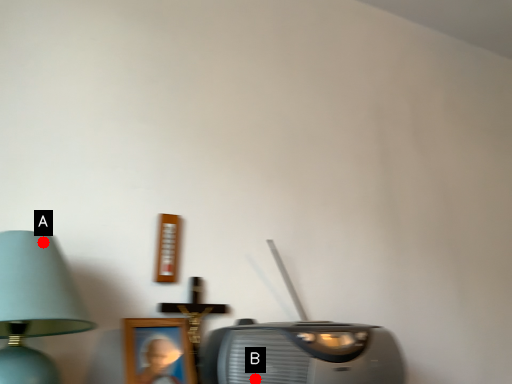
Question: Two points are circled on the image, labeled by A and B beside each circle. Which point is closer to the camera?

Choices:
 (A) A is closer
 (B) B is closer

Answer: (A)